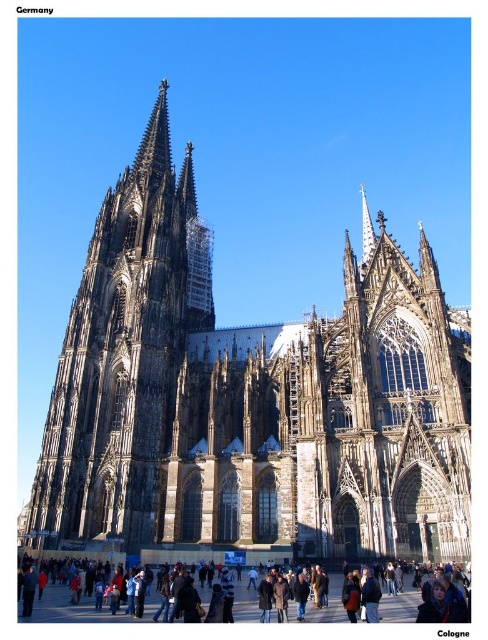
You are a tourist standing in front of the Cologne Cathedral. You notice a dark gray stone tower at left and a dark brown leather jacket at lower center. Which object is taller?

The dark gray stone tower at left is much taller than the dark brown leather jacket at lower center.

You are standing in front of the Cologne Cathedral and see the dark gray stone church at center and the dark brown leather jacket at lower center. Which object is positioned to the right side?

The dark gray stone church at center is positioned to the right of the dark brown leather jacket at lower center.

Consider the image. You are a tourist standing in front of the Cologne Cathedral and want to take a photo of the dark gray stone tower at left and the dark brown leather jacket at lower center. Which object should you focus on first to ensure it appears larger in your photo?

The dark gray stone tower at left is closer to you than the dark brown leather jacket at lower center, so focusing on it first will make it appear larger in the photo.